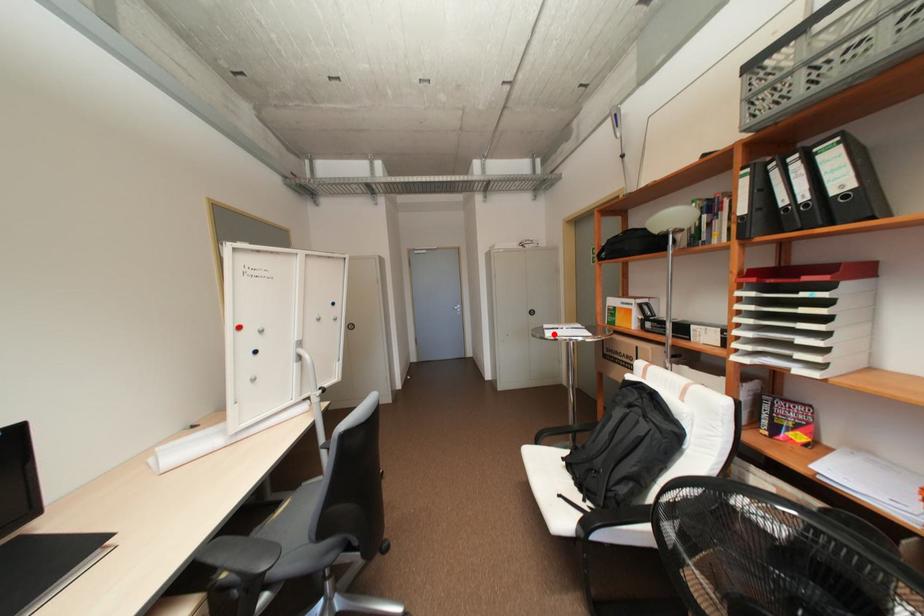
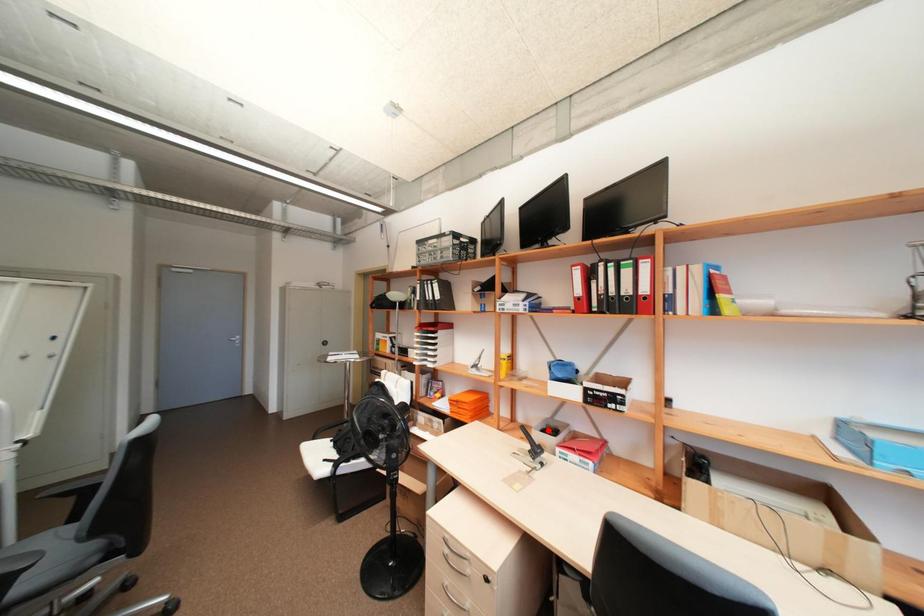
I am providing you with two images of the same scene from different viewpoints. A red point is marked on the first image and another point is marked on the second image. Are the points marked in image1 and image2 representing the same 3D position?

No